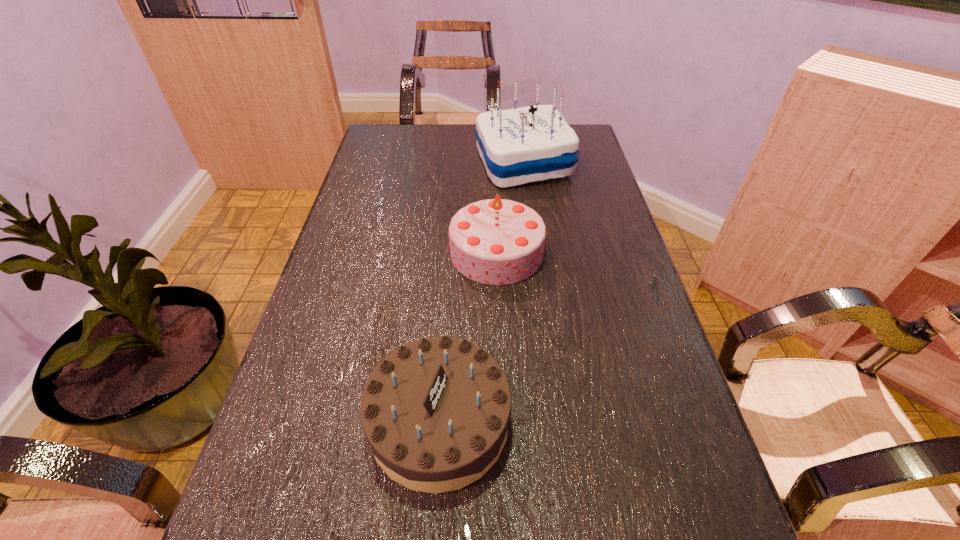
You are a GUI agent. You are given a task and a screenshot of the screen. Output one action in this format:
    pyautogui.click(x=<x>, y=<y>)
    Task: Click on the second closest object to the second farthest birthday cake
    The height and width of the screenshot is (540, 960).
    Given the screenshot: What is the action you would take?
    pyautogui.click(x=436, y=411)

Choose which birthday cake is the nearest neighbor to the farthest object. Please provide its 2D coordinates. Your answer should be formatted as a tuple, i.e. [(x, y)], where the tuple contains the x and y coordinates of a point satisfying the conditions above.

[(495, 241)]

Where is `birthday cake that can be found as the second closest to the nearest object`? The width and height of the screenshot is (960, 540). birthday cake that can be found as the second closest to the nearest object is located at coordinates (517, 146).

Where is `vacant area that satisfies the following two spatial constraints: 1. on the front side of the tallest birthday cake; 2. on the front-facing side of the nearest object`? This screenshot has width=960, height=540. vacant area that satisfies the following two spatial constraints: 1. on the front side of the tallest birthday cake; 2. on the front-facing side of the nearest object is located at coordinates (558, 422).